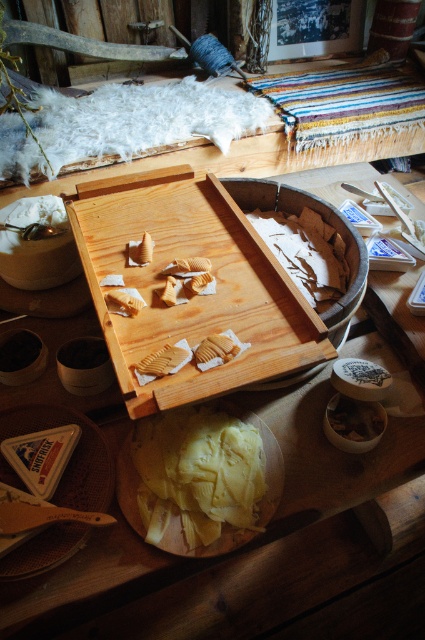
Question: Where is white crumbly food at center located in relation to golden textured cookie at center in the image?

Choices:
 (A) below
 (B) above

Answer: (B)

Question: Is white crumbly food at center closer to the viewer compared to white creamy cheese at lower center?

Choices:
 (A) yes
 (B) no

Answer: (B)

Question: Which object is farther from the camera taking this photo?

Choices:
 (A) natural wood cutting board at center
 (B) wooden carved piece at center
 (C) golden textured cookie at center
 (D) white creamy cheese at lower center

Answer: (D)

Question: Which of the following is the closest to the observer?

Choices:
 (A) (190, 440)
 (B) (170, 348)
 (C) (316, 262)

Answer: (B)

Question: Does yellow wax at center come in front of white crumbly food at center?

Choices:
 (A) no
 (B) yes

Answer: (B)

Question: Among these points, which one is nearest to the camera?

Choices:
 (A) (261, 278)
 (B) (295, 236)
 (C) (370, 420)

Answer: (C)